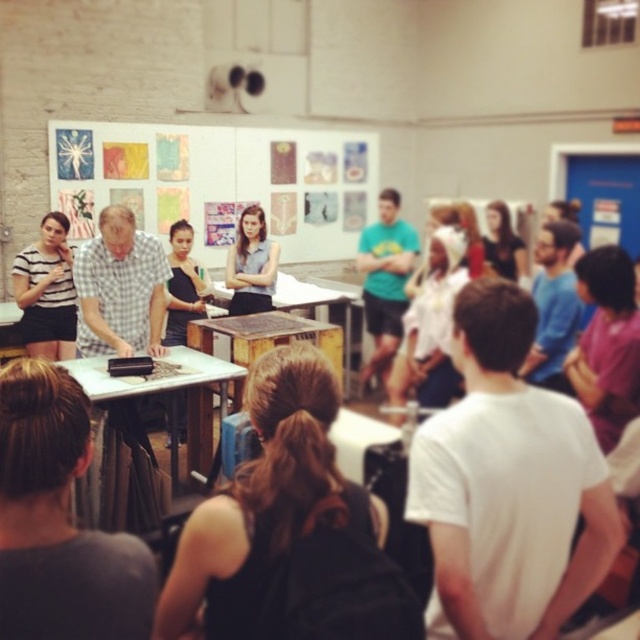
Question: Is brown hair at center positioned in front of striped fabric shirt at left?

Choices:
 (A) yes
 (B) no

Answer: (A)

Question: Which point is farther to the camera?

Choices:
 (A) (326, 356)
 (B) (182, 353)

Answer: (B)

Question: Estimate the real-world distances between objects in this image. Which object is farther from the brown hair at center?

Choices:
 (A) matte gray shirt at center
 (B) striped fabric shirt at left

Answer: (A)

Question: Can you confirm if brown hair at center is thinner than matte gray shirt at center?

Choices:
 (A) no
 (B) yes

Answer: (A)

Question: Can you confirm if brown hair at center is bigger than matte gray shirt at center?

Choices:
 (A) yes
 (B) no

Answer: (A)

Question: Which object is closer to the camera taking this photo?

Choices:
 (A) striped fabric shirt at left
 (B) brown hair at center
 (C) matte gray shirt at center
 (D) wooden at center

Answer: (B)